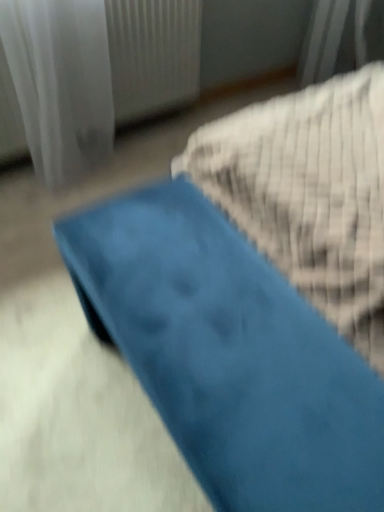
Where is `free spot below white sheer curtain at upper left (from a real-world perspective)`? This screenshot has height=512, width=384. free spot below white sheer curtain at upper left (from a real-world perspective) is located at coordinates (135, 136).